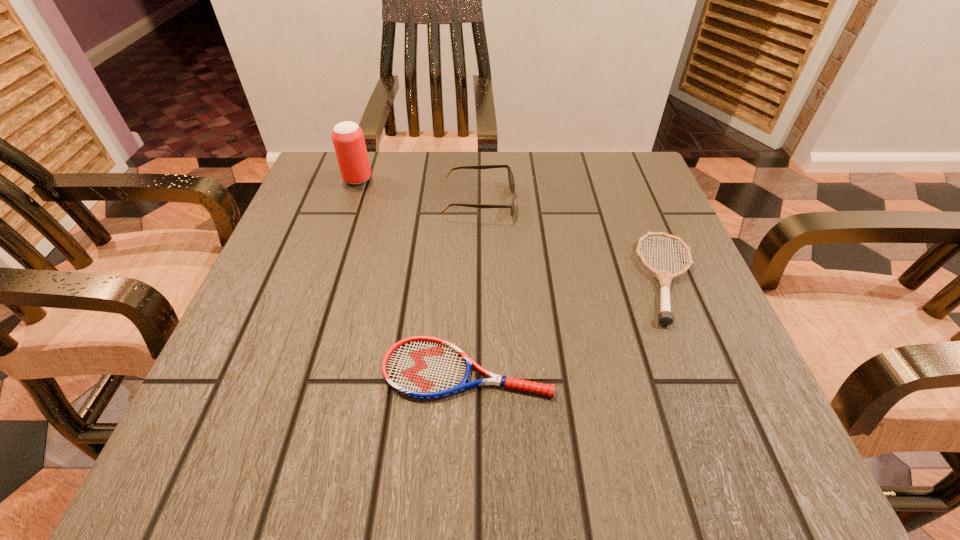
Where is `vacant space located on the right of the shortest object`? This screenshot has width=960, height=540. vacant space located on the right of the shortest object is located at coordinates (710, 369).

The width and height of the screenshot is (960, 540). I want to click on beer can positioned at the far edge, so click(x=348, y=139).

You are a GUI agent. You are given a task and a screenshot of the screen. Output one action in this format:
    pyautogui.click(x=<x>, y=<y>)
    Task: Click on the sunglasses present at the far edge
    Image resolution: width=960 pixels, height=540 pixels.
    Given the screenshot: What is the action you would take?
    pyautogui.click(x=510, y=175)

Locate an element on the screen. object that is at the left edge is located at coordinates (348, 139).

Locate an element on the screen. The width and height of the screenshot is (960, 540). object at the right edge is located at coordinates (665, 317).

Locate an element on the screen. Image resolution: width=960 pixels, height=540 pixels. object at the far left corner is located at coordinates (348, 139).

Locate an element on the screen. The image size is (960, 540). vacant area at the far edge is located at coordinates (428, 191).

The width and height of the screenshot is (960, 540). In order to click on free region at the near edge in this screenshot , I will do `click(572, 477)`.

Where is `vacant space at the left edge of the desktop`? This screenshot has width=960, height=540. vacant space at the left edge of the desktop is located at coordinates (319, 220).

Find the location of a particular element. free space at the right edge of the desktop is located at coordinates (736, 388).